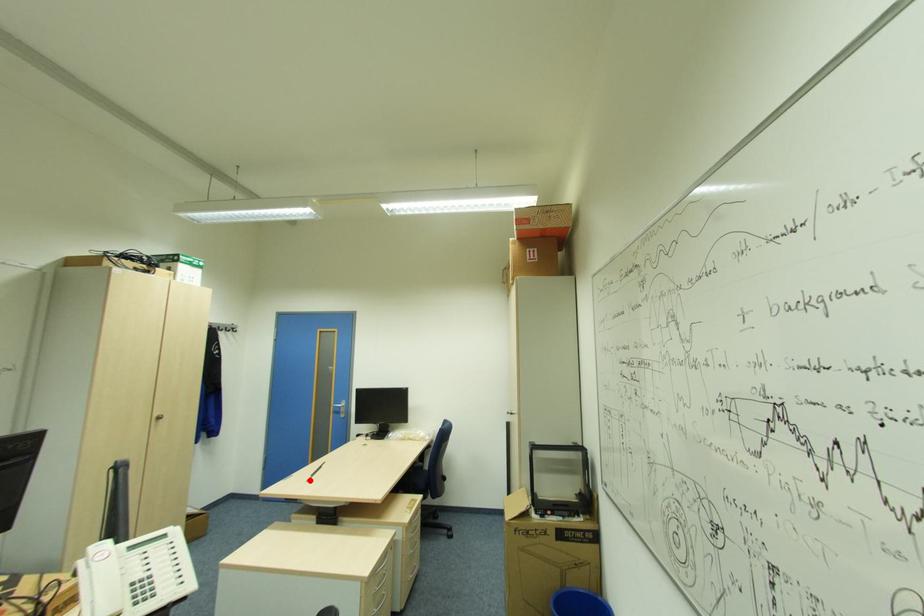
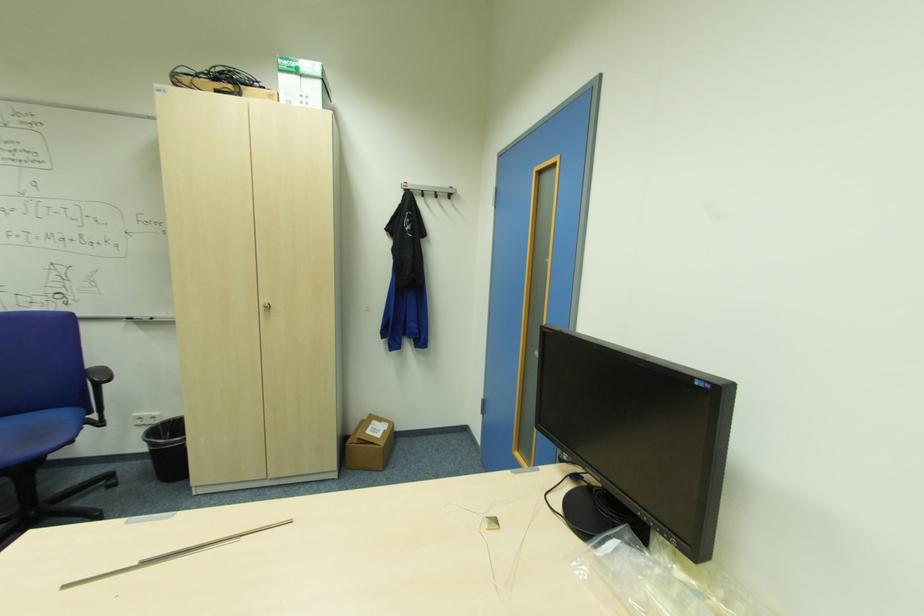
Question: A red point is marked in image1. In image2, is the corresponding 3D point closer to the camera or farther? Reply with the corresponding letter.

Choices:
 (A) The corresponding 3D point is closer.
 (B) The corresponding 3D point is farther.

Answer: (A)